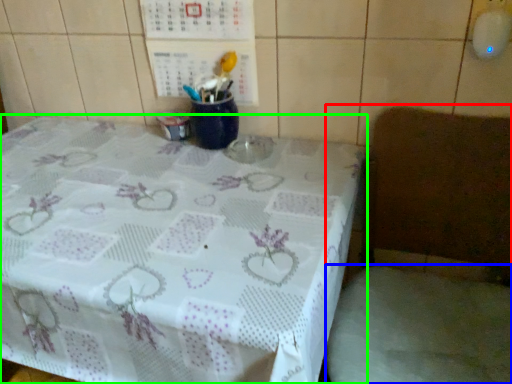
Question: Estimate the real-world distances between objects in this image. Which object is farther from chair (highlighted by a red box), fabric (highlighted by a blue box) or table (highlighted by a green box)?

Choices:
 (A) fabric
 (B) table

Answer: (B)